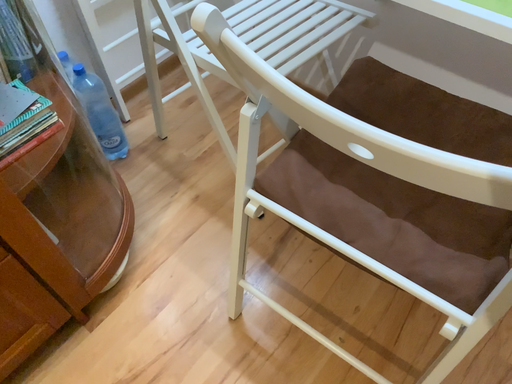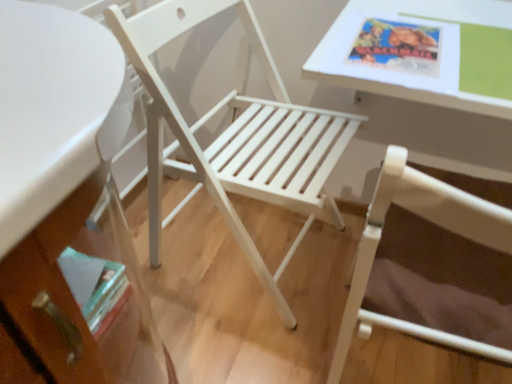
Question: Which way did the camera rotate in the video?

Choices:
 (A) rotated right
 (B) rotated left

Answer: (A)